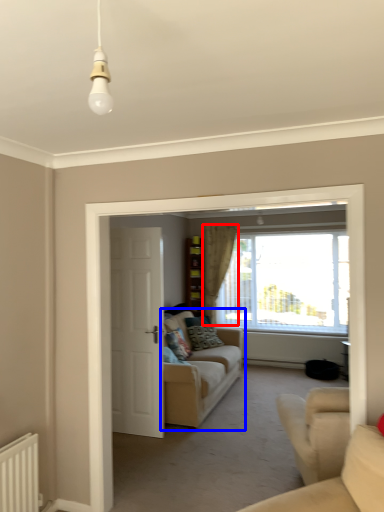
Question: Among these objects, which one is nearest to the camera, curtain (highlighted by a red box) or studio couch (highlighted by a blue box)?

Choices:
 (A) curtain
 (B) studio couch

Answer: (B)